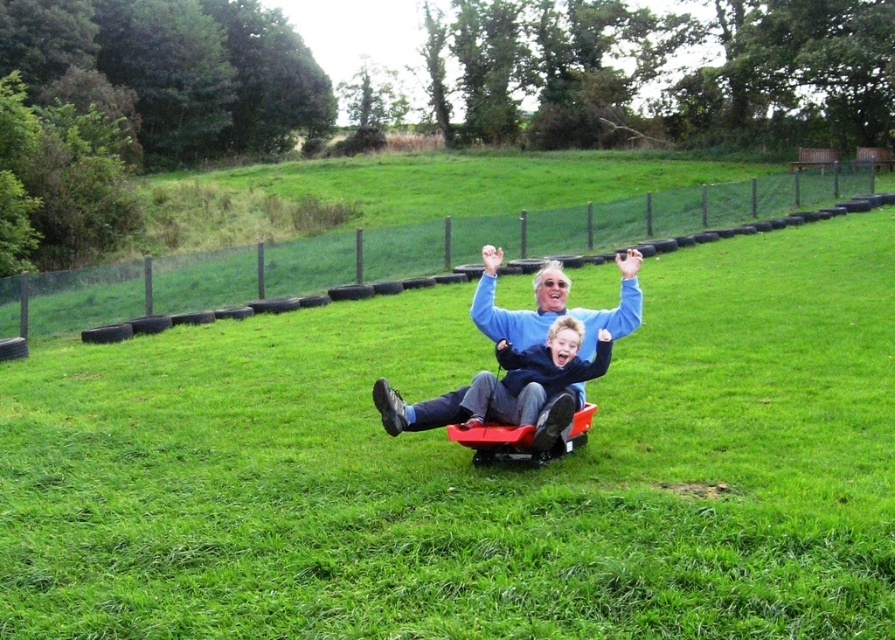
Question: Is blue smooth sweater at center to the left of red plastic wagon at center from the viewer's perspective?

Choices:
 (A) no
 (B) yes

Answer: (B)

Question: Can you confirm if blue smooth sweater at center is wider than red plastic wagon at center?

Choices:
 (A) no
 (B) yes

Answer: (A)

Question: Is blue smooth sweater at center below red plastic wagon at center?

Choices:
 (A) no
 (B) yes

Answer: (A)

Question: Which of the following is the farthest from the observer?

Choices:
 (A) [x=561, y=424]
 (B) [x=585, y=339]

Answer: (B)

Question: Which object appears farthest from the camera in this image?

Choices:
 (A) blue smooth sweater at center
 (B) red plastic wagon at center

Answer: (A)

Question: Which of the following is the farthest from the observer?

Choices:
 (A) (487, 244)
 (B) (581, 440)

Answer: (A)